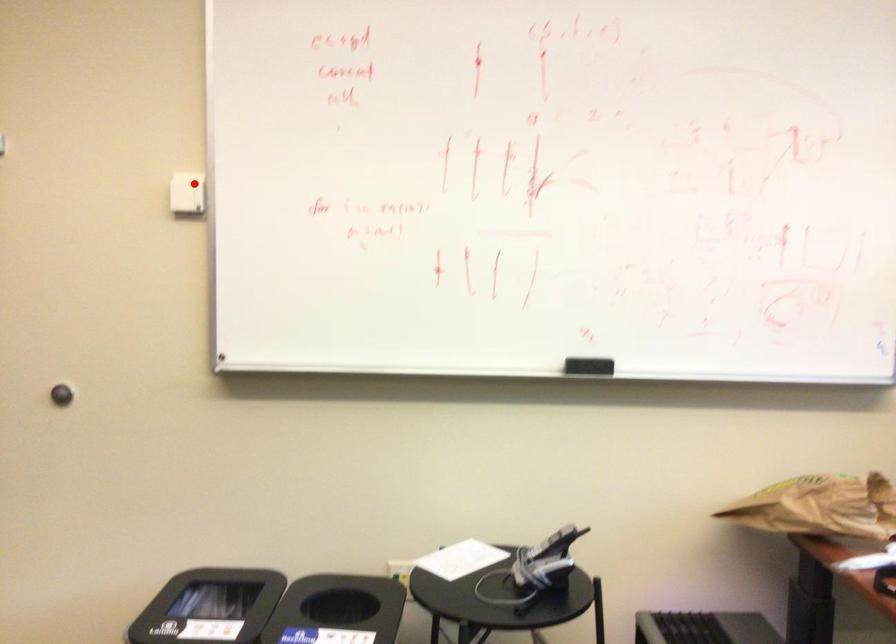
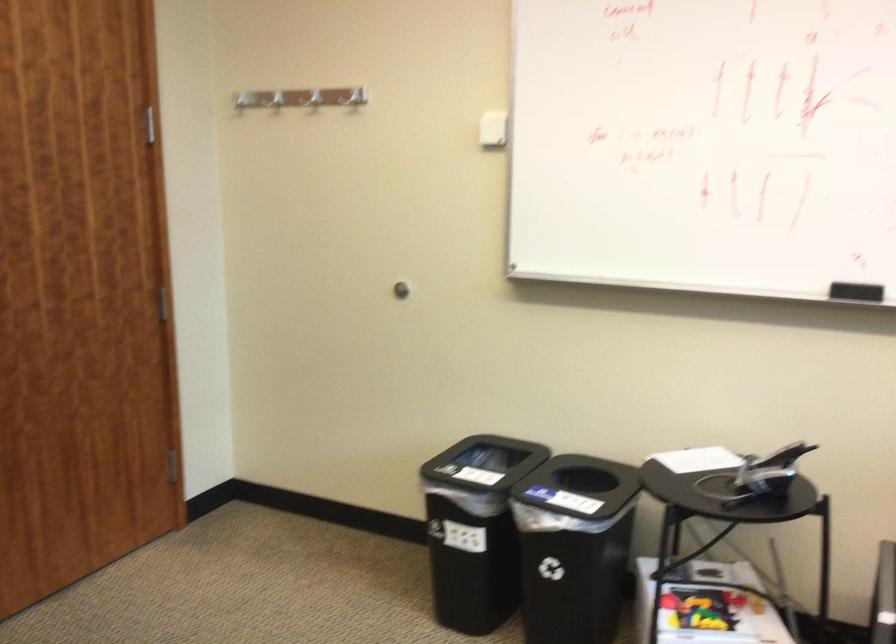
The point at the highlighted location is marked in the first image. Where is the corresponding point in the second image?

(493, 129)